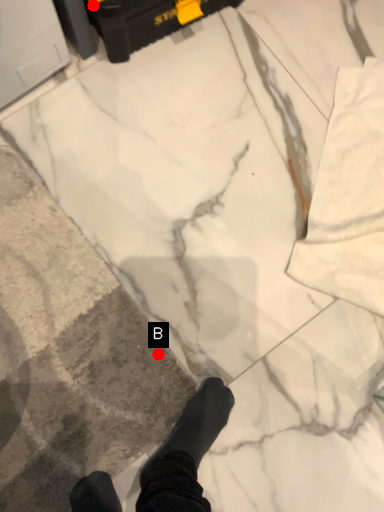
Question: Two points are circled on the image, labeled by A and B beside each circle. Which point is farther from the camera taking this photo?

Choices:
 (A) A is further
 (B) B is further

Answer: (B)